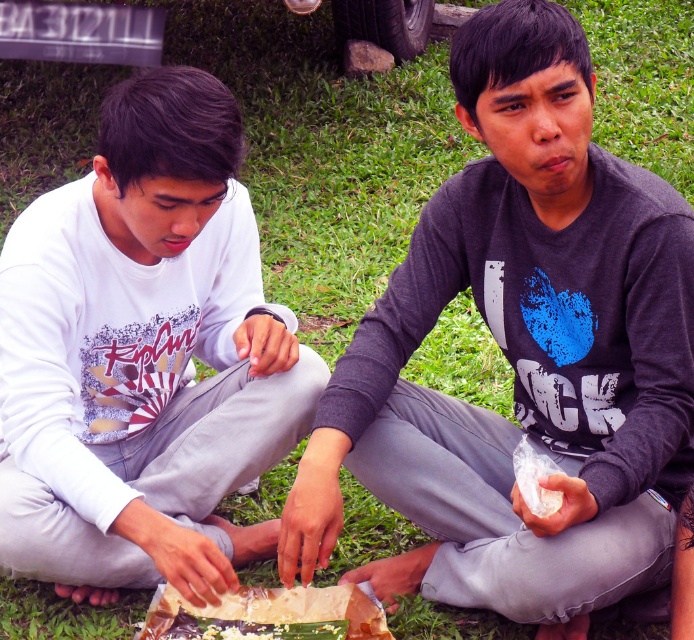
Question: Is gray matte shirt at center bigger than white matte shirt at center?

Choices:
 (A) yes
 (B) no

Answer: (A)

Question: Does white matte shirt at center appear over translucent plastic wrap at center?

Choices:
 (A) yes
 (B) no

Answer: (A)

Question: Which object is the farthest from the white matte shirt at center?

Choices:
 (A) gray matte shirt at center
 (B) translucent plastic wrap at center

Answer: (A)

Question: Is gray matte shirt at center to the right of translucent plastic wrap at center from the viewer's perspective?

Choices:
 (A) yes
 (B) no

Answer: (A)

Question: Which of the following is the closest to the observer?

Choices:
 (A) gray matte shirt at center
 (B) white matte shirt at center

Answer: (A)

Question: Which point is closer to the camera?

Choices:
 (A) (194, 483)
 (B) (316, 628)

Answer: (B)